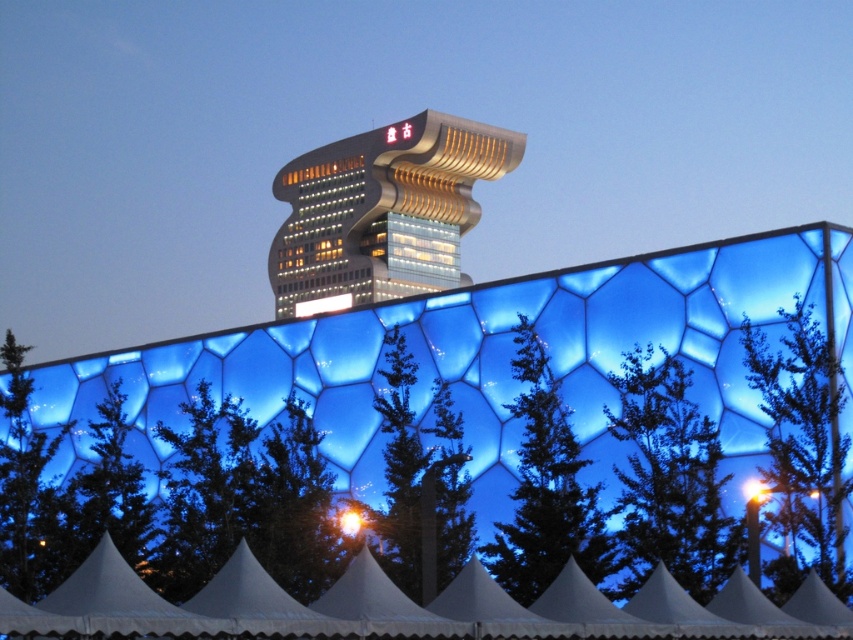
Between point (106, 600) and point (405, 129), which one is positioned behind?

Positioned behind is point (405, 129).

Image resolution: width=853 pixels, height=640 pixels. I want to click on white fabric tent at lower center, so click(x=410, y=605).

Who is positioned more to the right, metallic glass tower at upper center or bright yellow light at lower center?

From the viewer's perspective, bright yellow light at lower center appears more on the right side.

Is the position of metallic glass tower at upper center less distant than that of bright yellow light at lower center?

No, it is not.

Does point (303, 288) come in front of point (345, 532)?

That is False.

Locate an element on the screen. metallic glass tower at upper center is located at coordinates (381, 212).

How much distance is there between bright yellow light at upper center and matte gold sign at upper center?

The distance of bright yellow light at upper center from matte gold sign at upper center is 139.45 meters.

Based on the photo, is bright yellow light at upper center further to camera compared to matte gold sign at upper center?

No, it is in front of matte gold sign at upper center.

Is point (751, 497) less distant than point (387, 134)?

Yes, it is in front of point (387, 134).

In order to click on bright yellow light at upper center in this screenshot , I will do pyautogui.click(x=756, y=492).